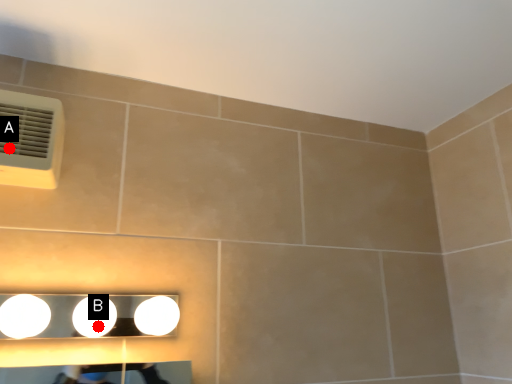
Question: Two points are circled on the image, labeled by A and B beside each circle. Which of the following is the farthest from the observer?

Choices:
 (A) A is further
 (B) B is further

Answer: (A)